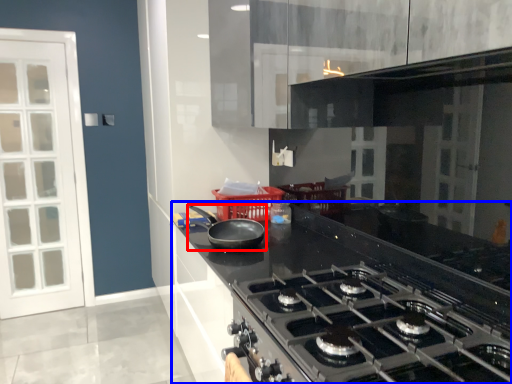
Question: Which point is further to the camera, kitchen appliance (highlighted by a red box) or countertop (highlighted by a blue box)?

Choices:
 (A) kitchen appliance
 (B) countertop

Answer: (A)